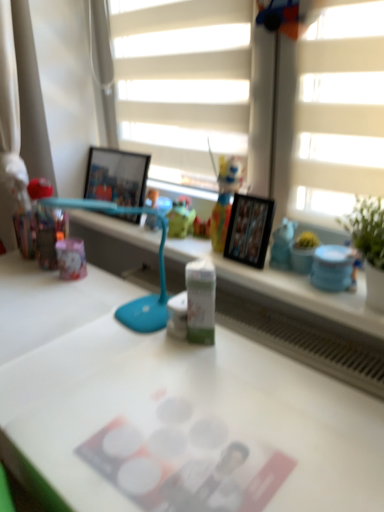
Find the location of a particular element. vacant space underneath teal plastic table lamp at center (from a real-world perspective) is located at coordinates (127, 326).